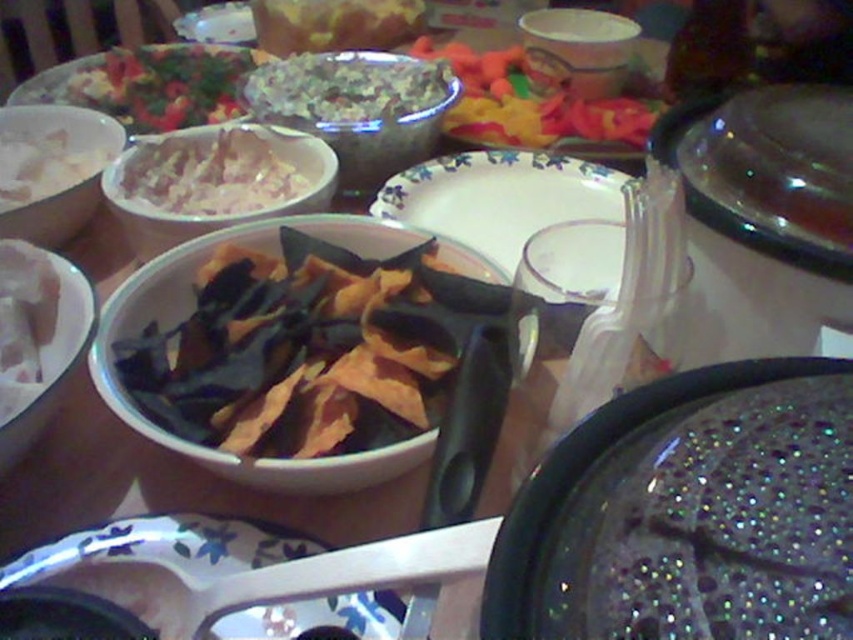
You are a guest at a dinner party and want to reach for the green leafy salad at center. Based on the coordinates provided, can you estimate its position relative to the other items on the table?

The green leafy salad at center is located at coordinates approximately 0.139 on the x and 0.403 on the y axis, which places it centrally positioned on the table.

You are setting up a buffet table and need to place the porcelain floral plate at center and the white matte bowl at upper left. Given their sizes, which one should you place first to ensure stability?

The white matte bowl at upper left should be placed first because it is larger than the porcelain floral plate at center, allowing for a stable base.